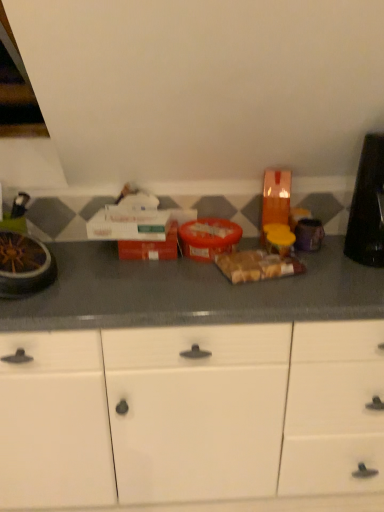
At what (x,y) coordinates should I click in order to perform the action: click on vacant space to the left of translucent plastic bag of bread at center. Please return your answer as a coordinate pair (x, y). Looking at the image, I should click on pos(192,275).